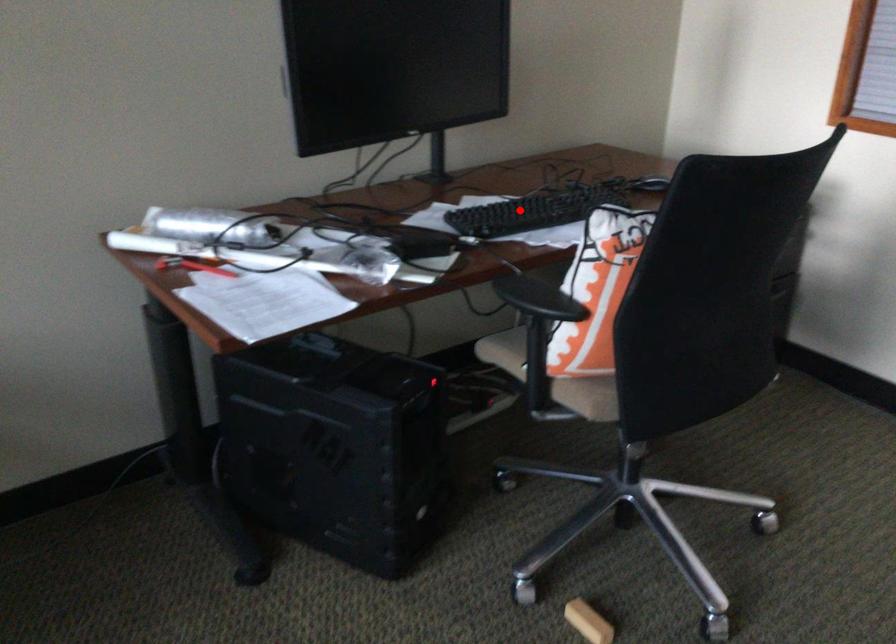
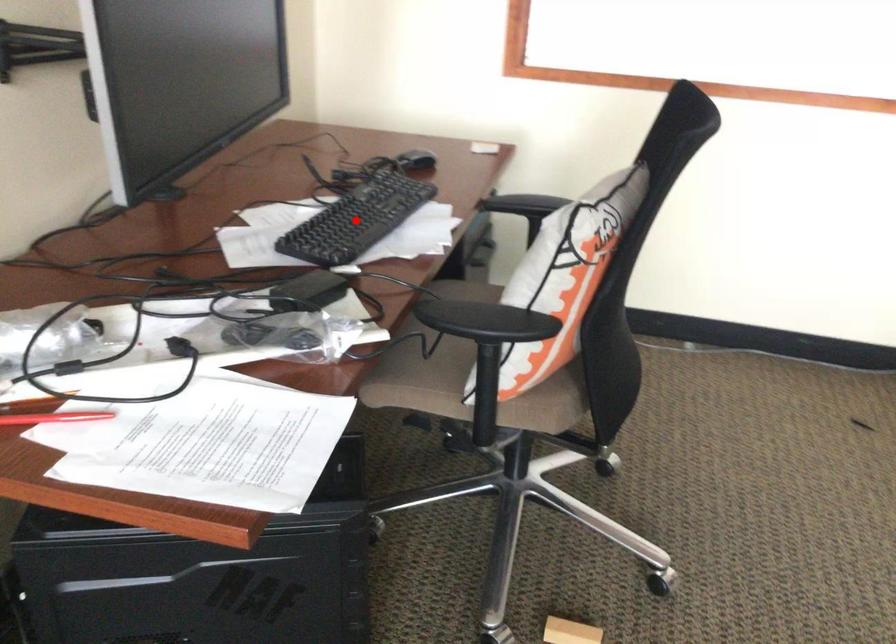
I am providing you with two images of the same scene from different viewpoints. A red point is marked on the first image and another point is marked on the second image. Does the point marked in image1 correspond to the same location as the one in image2?

Yes